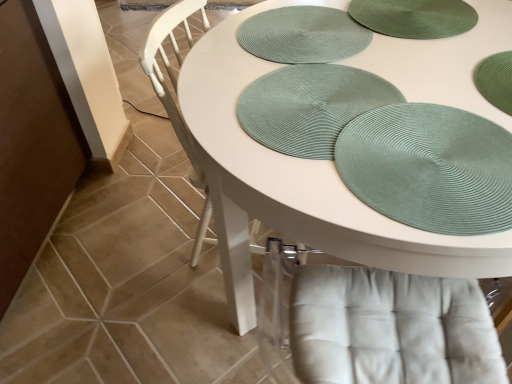
Where is `free space above green woven placemat at center, the 2th platter positioned from the back (from a real-world perspective)`? The image size is (512, 384). free space above green woven placemat at center, the 2th platter positioned from the back (from a real-world perspective) is located at coordinates pyautogui.click(x=321, y=106).